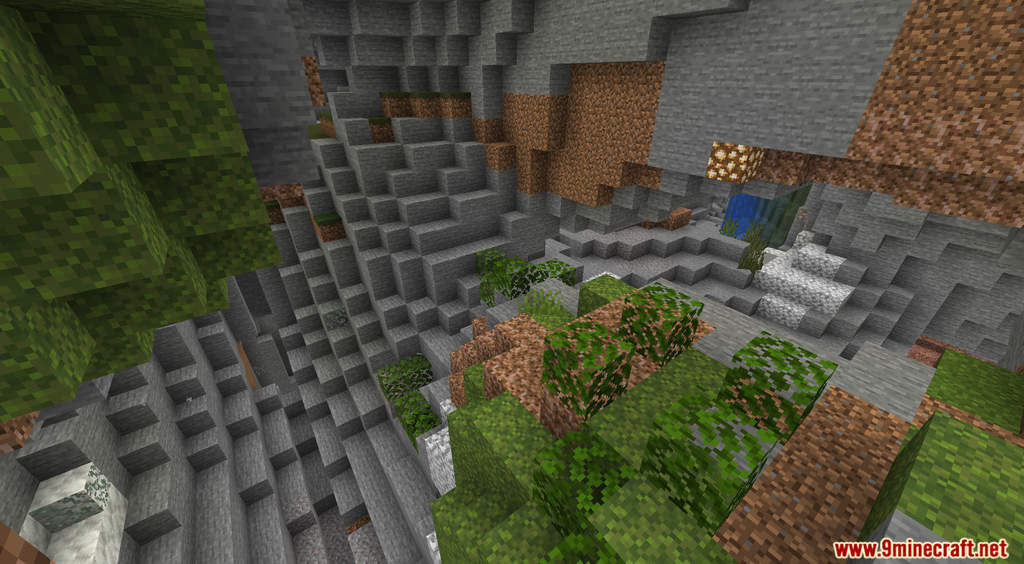
Where is `floor`? floor is located at coordinates (889, 377).